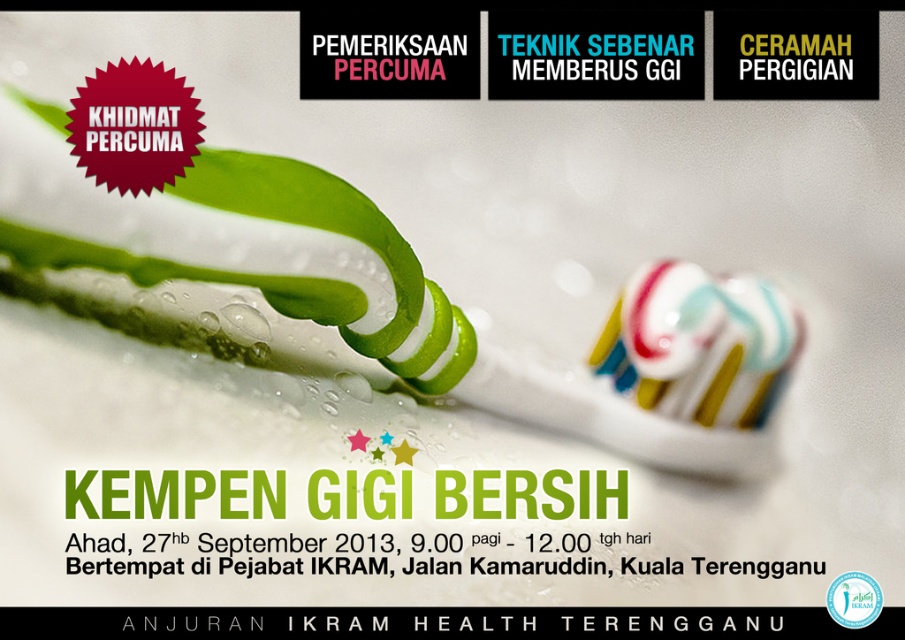
Based on the scene described, which object is taller between the green striped toothbrush at upper left and the multicolored striped toothpaste at center?

The green striped toothbrush at upper left is taller than the multicolored striped toothpaste at center.

You are a graphic designer working on a dental hygiene poster. You need to place a new text box between the green striped toothbrush at upper left and the multicolored striped toothpaste at center. Which object should the text box be closer to?

The text box should be closer to the green striped toothbrush at upper left because it is closer to the viewer than the multicolored striped toothpaste at center.